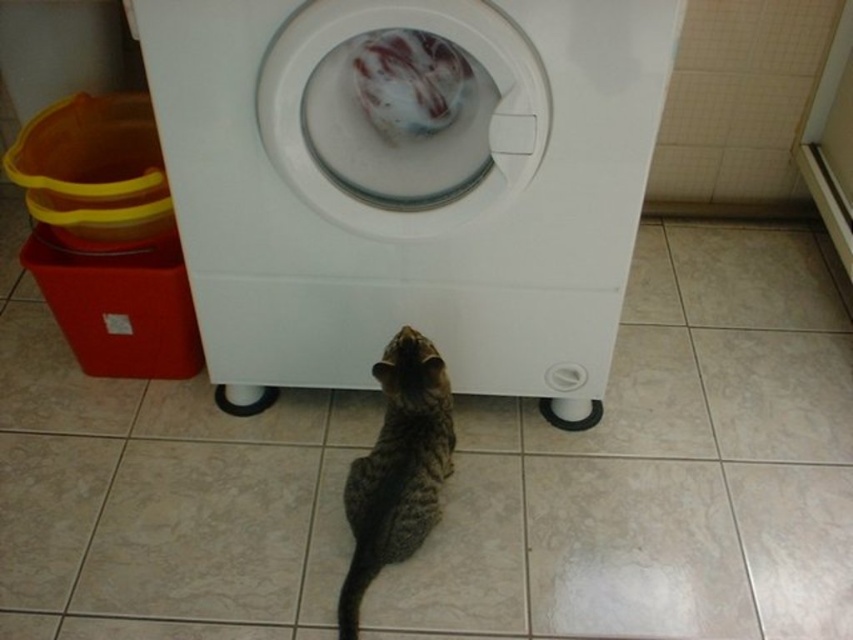
Is white plastic washing machine at center further to camera compared to tabby fur cat at center?

No, white plastic washing machine at center is closer to the viewer.

Is point (552, 60) positioned after point (390, 420)?

No, it is in front of (390, 420).

Does point (239, 312) come behind point (418, 496)?

Yes, it is behind point (418, 496).

Locate an element on the screen. The image size is (853, 640). white plastic washing machine at center is located at coordinates (408, 182).